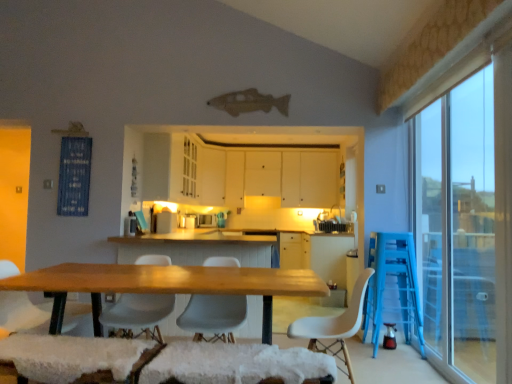
Question: Is point (489, 256) positioned closer to the camera than point (128, 336)?

Choices:
 (A) farther
 (B) closer

Answer: (A)

Question: In terms of width, does transparent glass window at right look wider or thinner when compared to white matte chair at center, which appears as the 3th chair when viewed from the right?

Choices:
 (A) wide
 (B) thin

Answer: (B)

Question: Which is farther from the transparent glass window at right?

Choices:
 (A) white matte cabinet at center, the first cabinetry when ordered from back to front
 (B) white fabric chair at lower left, arranged as the fourth chair when viewed from the right
 (C) white matte chair at center, which appears as the second chair when viewed from the left
 (D) white plastic chair at center, arranged as the 1th chair when viewed from the right
 (E) wooden table at center

Answer: (B)

Question: Which object is the farthest from the white matte cabinet at center, placed as the second cabinetry when sorted from front to back?

Choices:
 (A) wooden table at center
 (B) transparent glass window at right
 (C) white matte chair at center, which appears as the 3th chair when viewed from the right
 (D) white plastic chair at center, arranged as the 1th chair when viewed from the right
 (E) white plastic chair at center, arranged as the third chair when viewed from the left

Answer: (A)